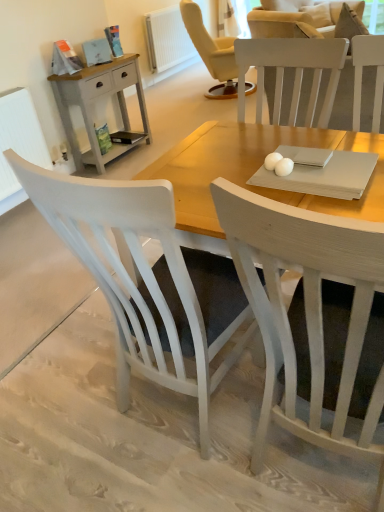
Image resolution: width=384 pixels, height=512 pixels. In order to click on free space below white wood chair at center, positioned as the first chair in left-to-right order (from a real-world perspective) in this screenshot , I will do `click(184, 413)`.